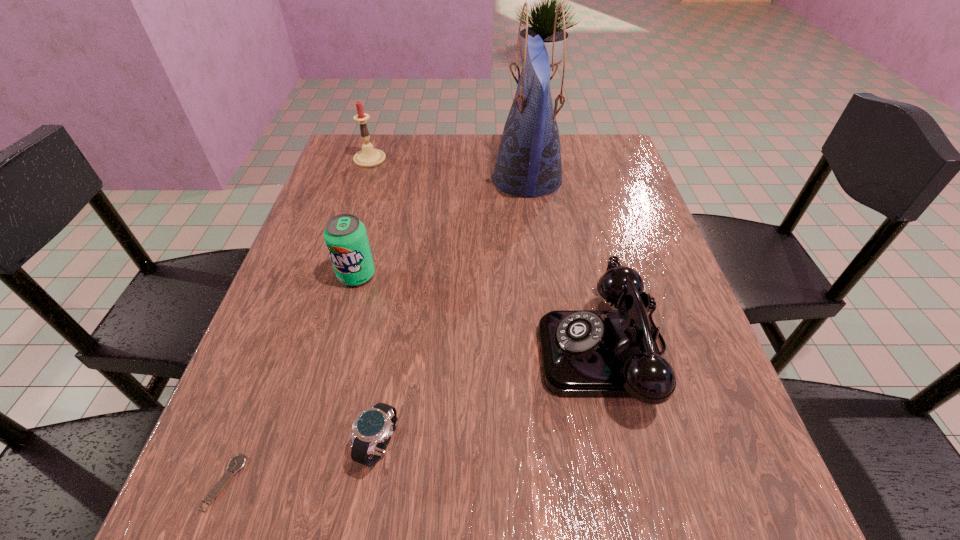
Identify the location of free space at the near left corner of the desktop. (288, 487).

At what (x,y) coordinates should I click in order to perform the action: click on blank area at the far right corner. Please return your answer as a coordinate pair (x, y). Image resolution: width=960 pixels, height=540 pixels. Looking at the image, I should click on (616, 167).

Where is `blank area at the near right corner`? The image size is (960, 540). blank area at the near right corner is located at coordinates pos(739,505).

Image resolution: width=960 pixels, height=540 pixels. Find the location of `vacant area between the second shortest object and the telephone`. vacant area between the second shortest object and the telephone is located at coordinates pos(492,398).

Find the location of a particular element. This screenshot has height=540, width=960. blank region between the left watch and the fifth shortest object is located at coordinates (297, 321).

Find the location of a particular element. The image size is (960, 540). free space between the shortest object and the pop soda is located at coordinates (290, 379).

I want to click on vacant space in between the pop soda and the second tallest object, so click(363, 217).

This screenshot has width=960, height=540. I want to click on vacant area between the second tallest object and the telephone, so click(488, 255).

Locate an element on the screen. The height and width of the screenshot is (540, 960). empty space that is in between the candle and the telephone is located at coordinates (488, 255).

Where is `vacant space that's between the telephone and the pop soda`? The width and height of the screenshot is (960, 540). vacant space that's between the telephone and the pop soda is located at coordinates (481, 313).